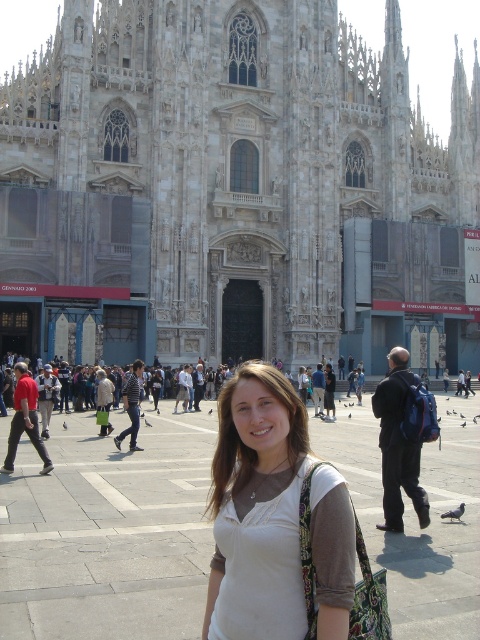
Question: Is gray stone church at center below white fabric shirt at center?

Choices:
 (A) yes
 (B) no

Answer: (B)

Question: Which object is closer to the camera taking this photo?

Choices:
 (A) gray stone church at center
 (B) white fabric shirt at center

Answer: (B)

Question: Which point is farther to the camera?

Choices:
 (A) (327, 634)
 (B) (396, 81)

Answer: (B)

Question: Is gray stone church at center further to camera compared to white fabric shirt at center?

Choices:
 (A) no
 (B) yes

Answer: (B)

Question: Does gray stone church at center have a larger size compared to white fabric shirt at center?

Choices:
 (A) yes
 (B) no

Answer: (A)